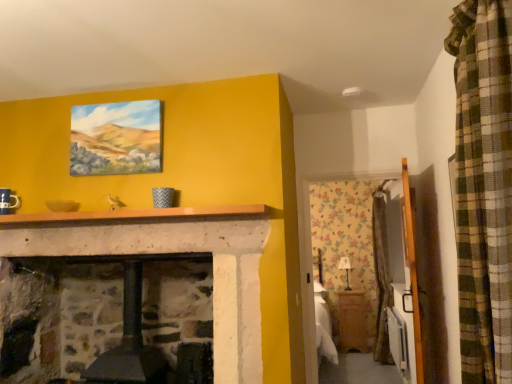
This screenshot has height=384, width=512. What do you see at coordinates (405, 265) in the screenshot?
I see `wooden armoire at right` at bounding box center [405, 265].

I want to click on wooden cabinet at lower right, so click(352, 321).

What do you see at coordinates (116, 138) in the screenshot? I see `matte canvas painting at upper center` at bounding box center [116, 138].

Where is `wooden armoire at right`? The height and width of the screenshot is (384, 512). wooden armoire at right is located at coordinates (405, 265).

Is smooth stone mantle at center to the left or to the right of wooden armoire at right in the image?

In the image, smooth stone mantle at center appears on the left side of wooden armoire at right.

Does smooth stone mantle at center contain wooden armoire at right?

Definitely not — wooden armoire at right is not inside smooth stone mantle at center.

In terms of size, does smooth stone mantle at center appear bigger or smaller than wooden armoire at right?

Considering their sizes, smooth stone mantle at center takes up less space than wooden armoire at right.

Considering the points (151, 215) and (411, 222), which point is behind, point (151, 215) or point (411, 222)?

The point (151, 215) is farther from the camera.

Choose the correct answer: Is wooden cabinet at lower right inside wooden armoire at right or outside it?

wooden cabinet at lower right lies outside wooden armoire at right.

How many degrees apart are the facing directions of wooden cabinet at lower right and wooden armoire at right?

The facing directions of wooden cabinet at lower right and wooden armoire at right are 100 degrees apart.

Is wooden cabinet at lower right taller or shorter than wooden armoire at right?

Clearly, wooden cabinet at lower right is shorter compared to wooden armoire at right.

Is smooth stone mantle at center turned away from matte canvas painting at upper center?

No, matte canvas painting at upper center is not at the back of smooth stone mantle at center.

Is smooth stone mantle at center closer to camera compared to matte canvas painting at upper center?

Yes.

Can you confirm if smooth stone mantle at center is taller than matte canvas painting at upper center?

No, smooth stone mantle at center is not taller than matte canvas painting at upper center.

Does smooth stone mantle at center have a smaller size compared to matte canvas painting at upper center?

Incorrect, smooth stone mantle at center is not smaller in size than matte canvas painting at upper center.

Is wooden armoire at right wider or thinner than smooth stone mantle at center?

Considering their sizes, wooden armoire at right looks slimmer than smooth stone mantle at center.

Locate an element on the screen. armoire that appears below the smooth stone mantle at center (from the image's perspective) is located at coordinates (405, 265).

From the image's perspective, which object appears higher, wooden armoire at right or smooth stone mantle at center?

smooth stone mantle at center.

Is wooden armoire at right not within smooth stone mantle at center?

Yes, wooden armoire at right is outside of smooth stone mantle at center.

In the scene shown: Between matte canvas painting at upper center and wooden cabinet at lower right, which one has larger size?

With larger size is wooden cabinet at lower right.

Image resolution: width=512 pixels, height=384 pixels. I want to click on picture frame lying in front of the wooden cabinet at lower right, so click(116, 138).

From the image's perspective, is matte canvas painting at upper center above or below wooden cabinet at lower right?

matte canvas painting at upper center is situated higher than wooden cabinet at lower right in the image.

Consider the image. Between matte canvas painting at upper center and wooden armoire at right, which one has larger size?

wooden armoire at right.

Based on the photo, is matte canvas painting at upper center not close to wooden armoire at right?

Yes, matte canvas painting at upper center is far from wooden armoire at right.

Which object is thinner, matte canvas painting at upper center or wooden armoire at right?

Thinner between the two is matte canvas painting at upper center.

From a real-world perspective, is matte canvas painting at upper center above or below wooden armoire at right?

matte canvas painting at upper center is above wooden armoire at right.

Does point (82, 163) come closer to viewer compared to point (225, 214)?

No, it is not.

Is matte canvas painting at upper center positioned before smooth stone mantle at center?

No, matte canvas painting at upper center is further to the viewer.

Considering the sizes of objects matte canvas painting at upper center and smooth stone mantle at center in the image provided, who is wider, matte canvas painting at upper center or smooth stone mantle at center?

smooth stone mantle at center is wider.

In the image, is matte canvas painting at upper center on the left side or the right side of smooth stone mantle at center?

Based on their positions, matte canvas painting at upper center is located to the left of smooth stone mantle at center.

Where is `mantle above the wooden armoire at right (from the image's perspective)`? This screenshot has height=384, width=512. mantle above the wooden armoire at right (from the image's perspective) is located at coordinates (134, 214).

Find the location of a particular element. Image resolution: width=512 pixels, height=384 pixels. armoire that appears above the wooden cabinet at lower right (from a real-world perspective) is located at coordinates (405, 265).

Which object lies further to the anchor point smooth stone mantle at center, wooden cabinet at lower right or matte canvas painting at upper center?

wooden cabinet at lower right is further to smooth stone mantle at center.

Based on their spatial positions, is wooden armoire at right or smooth stone mantle at center further from wooden cabinet at lower right?

smooth stone mantle at center is positioned further to the anchor wooden cabinet at lower right.

Based on their spatial positions, is wooden armoire at right or smooth stone mantle at center further from matte canvas painting at upper center?

The object further to matte canvas painting at upper center is wooden armoire at right.

Consider the image. Estimate the real-world distances between objects in this image. Which object is closer to smooth stone mantle at center, wooden armoire at right or wooden cabinet at lower right?

The object closer to smooth stone mantle at center is wooden armoire at right.

Estimate the real-world distances between objects in this image. Which object is further from wooden armoire at right, wooden cabinet at lower right or matte canvas painting at upper center?

matte canvas painting at upper center.

When comparing their distances from smooth stone mantle at center, does matte canvas painting at upper center or wooden armoire at right seem closer?

matte canvas painting at upper center.

Estimate the real-world distances between objects in this image. Which object is closer to smooth stone mantle at center, wooden cabinet at lower right or wooden armoire at right?

Among the two, wooden armoire at right is located nearer to smooth stone mantle at center.

From the image, which object appears to be nearer to wooden cabinet at lower right, matte canvas painting at upper center or wooden armoire at right?

wooden armoire at right is positioned closer to the anchor wooden cabinet at lower right.

Where is `picture frame between smooth stone mantle at center and wooden cabinet at lower right along the z-axis`? This screenshot has height=384, width=512. picture frame between smooth stone mantle at center and wooden cabinet at lower right along the z-axis is located at coordinates (116, 138).

At what (x,y) coordinates should I click in order to perform the action: click on picture frame located between wooden armoire at right and wooden cabinet at lower right in the depth direction. Please return your answer as a coordinate pair (x, y). Looking at the image, I should click on (116, 138).

In order to click on armoire between smooth stone mantle at center and wooden cabinet at lower right in the front-back direction in this screenshot , I will do `click(405, 265)`.

You are a GUI agent. You are given a task and a screenshot of the screen. Output one action in this format:
    pyautogui.click(x=<x>, y=<y>)
    Task: Click on the mantle between matte canvas painting at upper center and wooden armoire at right from left to right
    
    Given the screenshot: What is the action you would take?
    pyautogui.click(x=134, y=214)